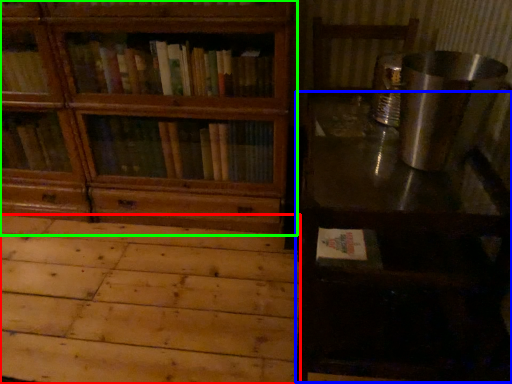
Question: Which object is the closest to the plywood (highlighted by a red box)? Choose among these: table (highlighted by a blue box) or bookcase (highlighted by a green box).

Choices:
 (A) table
 (B) bookcase

Answer: (B)